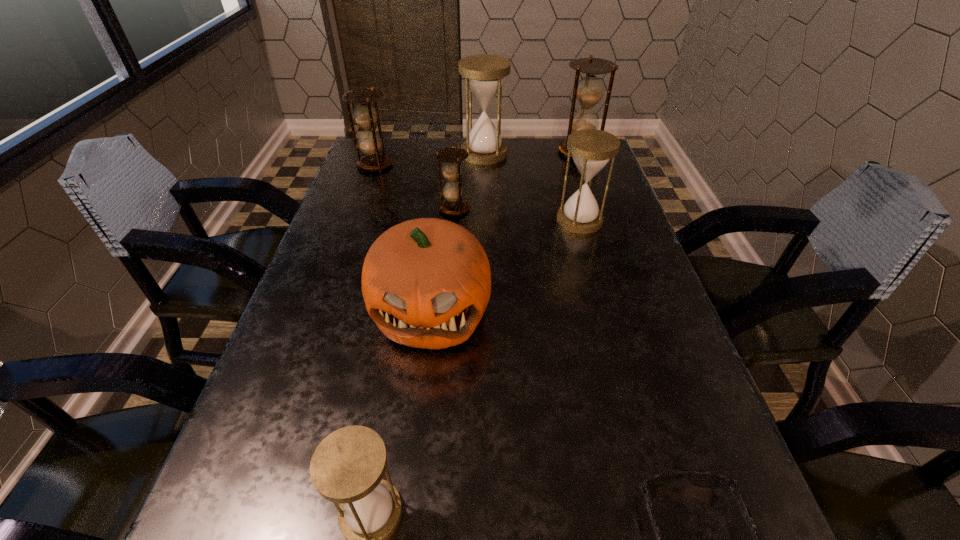
Identify the location of vacant region between the second white hourglass from left to right and the second smallest white hourglass. The height and width of the screenshot is (540, 960). (532, 187).

The width and height of the screenshot is (960, 540). Identify the location of object that is the sixth closest to the biggest white hourglass. (347, 467).

Locate which object ranks fifth in proximity to the biggest brown hourglass. Please provide its 2D coordinates. Your answer should be formatted as a tuple, i.e. [(x, y)], where the tuple contains the x and y coordinates of a point satisfying the conditions above.

[(426, 283)]

In order to click on hourglass that stands as the closest to the black sunglasses in this screenshot , I will do tap(347, 467).

Identify which hourglass is the second closest to the sixth farthest object. Please provide its 2D coordinates. Your answer should be formatted as a tuple, i.e. [(x, y)], where the tuple contains the x and y coordinates of a point satisfying the conditions above.

[(591, 149)]

You are a GUI agent. You are given a task and a screenshot of the screen. Output one action in this format:
    pyautogui.click(x=<x>, y=<y>)
    Task: Click on the white hourglass that is the third closest one to the sixth farthest object
    
    Given the screenshot: What is the action you would take?
    pyautogui.click(x=484, y=74)

Point out which white hourglass is positioned as the nearest to the second biggest brown hourglass. Please provide its 2D coordinates. Your answer should be formatted as a tuple, i.e. [(x, y)], where the tuple contains the x and y coordinates of a point satisfying the conditions above.

[(484, 74)]

Choose which brown hourglass is the nearest neighbor to the biggest brown hourglass. Please provide its 2D coordinates. Your answer should be formatted as a tuple, i.e. [(x, y)], where the tuple contains the x and y coordinates of a point satisfying the conditions above.

[(451, 156)]

Select which brown hourglass is the third closest to the second white hourglass from left to right. Please provide its 2D coordinates. Your answer should be formatted as a tuple, i.e. [(x, y)], where the tuple contains the x and y coordinates of a point satisfying the conditions above.

[(365, 115)]

Identify the location of free space that satisfies the following two spatial constraints: 1. on the front side of the second farthest white hourglass; 2. on the right side of the second brown hourglass from right to left. (453, 220).